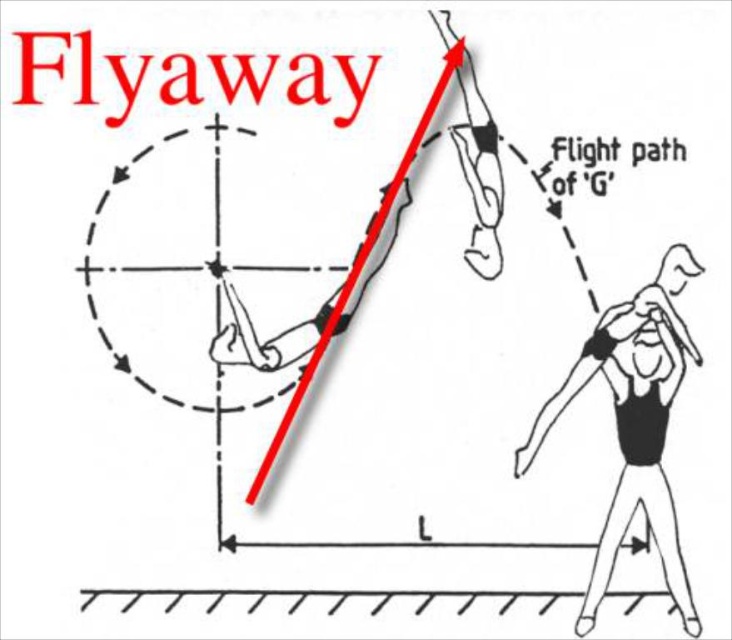
You are analyzing the diagram of the Flyaway maneuver. There are two points labeled in the diagram, point (649, 483) and point (438, 593). If you were to move forward towards the diagram, which point would appear closer to you first?

Point (649, 483) is closer to the camera than point (438, 593), so as you move forward, point (649, 483) would appear closer first.

Based on the diagram explaining Flyaway, which object is closer to the viewer between the black matte figure at center and the smooth concrete floor at lower center?

The black matte figure at center is closer to the viewer than the smooth concrete floor at lower center.

Based on the diagram explaining Flyaway, which object is bigger between the black matte figure at center and the smooth concrete floor at lower center?

The black matte figure at center is larger in size compared to the smooth concrete floor at lower center.